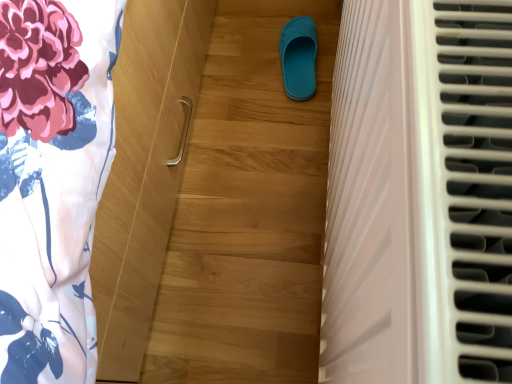
Question: Considering the positions of teal rubber slipper at center and white plastic radiator at right in the image, is teal rubber slipper at center wider or thinner than white plastic radiator at right?

Choices:
 (A) wide
 (B) thin

Answer: (B)

Question: Is teal rubber slipper at center spatially inside white plastic radiator at right, or outside of it?

Choices:
 (A) inside
 (B) outside

Answer: (B)

Question: Relative to white plastic radiator at right, is teal rubber slipper at center in front or behind?

Choices:
 (A) front
 (B) behind

Answer: (B)

Question: Based on their sizes in the image, would you say white plastic radiator at right is bigger or smaller than teal rubber slipper at center?

Choices:
 (A) big
 (B) small

Answer: (A)

Question: From a real-world perspective, is white plastic radiator at right physically located above or below teal rubber slipper at center?

Choices:
 (A) above
 (B) below

Answer: (A)

Question: Visually, is white plastic radiator at right positioned to the left or to the right of teal rubber slipper at center?

Choices:
 (A) right
 (B) left

Answer: (A)

Question: Is point (353, 329) closer or farther from the camera than point (302, 59)?

Choices:
 (A) farther
 (B) closer

Answer: (B)